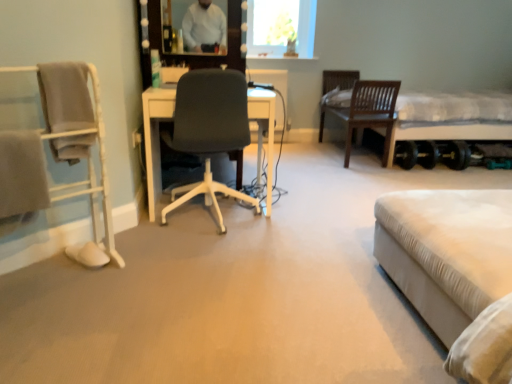
This screenshot has height=384, width=512. Identify the location of vacant area that lies between white fabric bed at lower right, the second bed from the back, and white fabric chair at left, placed as the 1th chair when sorted from left to right. (240, 301).